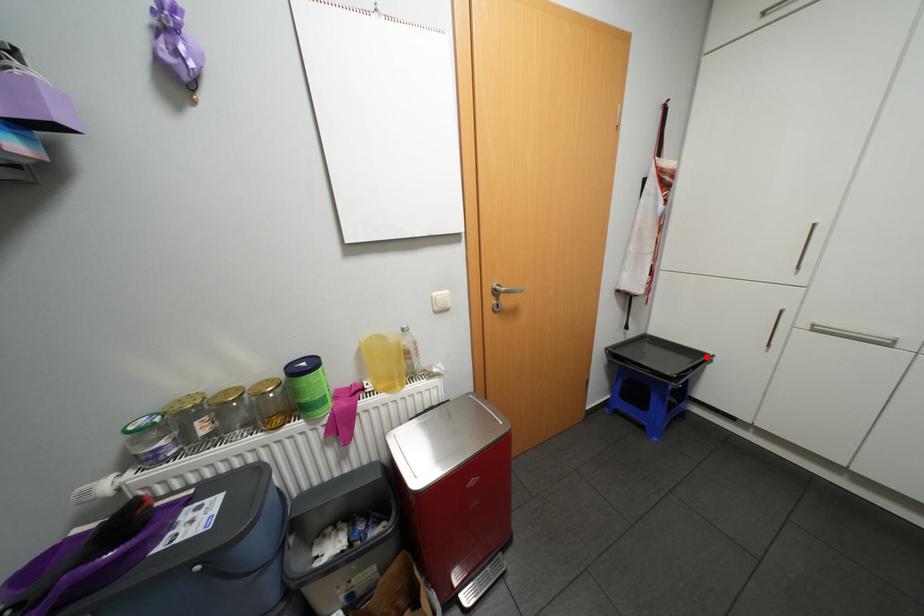
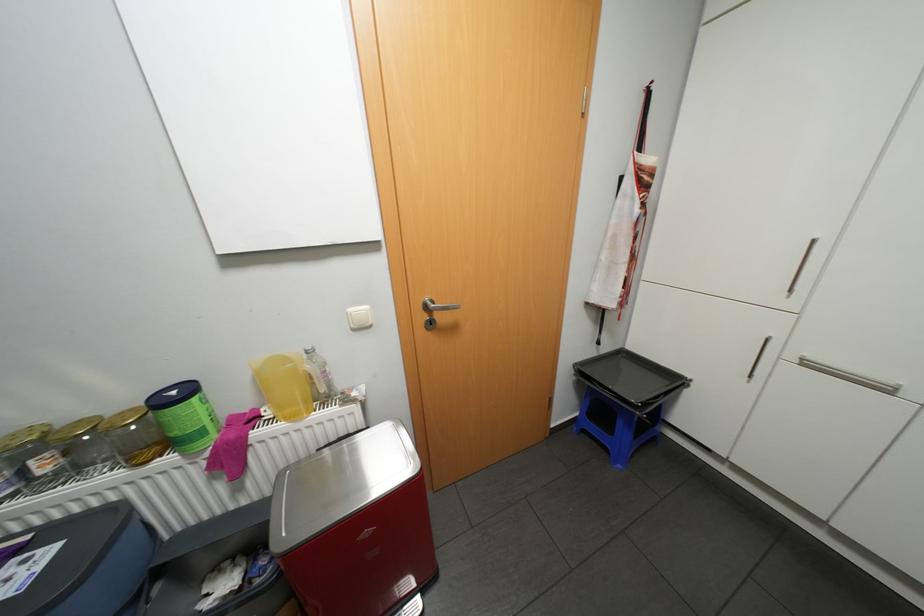
Find the pixel in the second image that matches the highlighted location in the first image.

(684, 379)